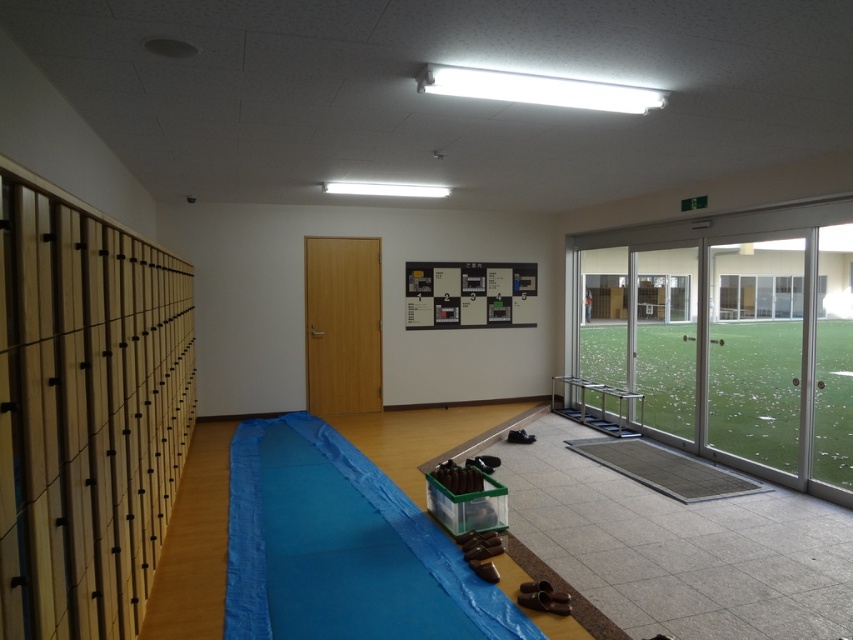
You are standing in the locker room and need to pick up two items located at point (776, 404) and point (370, 499). Which point is closer to you?

Point (370, 499) is closer to you because it is less further away than point (776, 404).

You are standing in the locker room and want to exit through the transparent glass door at right. Based on the coordinates provided, can you estimate the direction you should walk to reach it?

The transparent glass door at right is located at coordinates point (727,339), so you should walk towards the right side of the room to reach it.